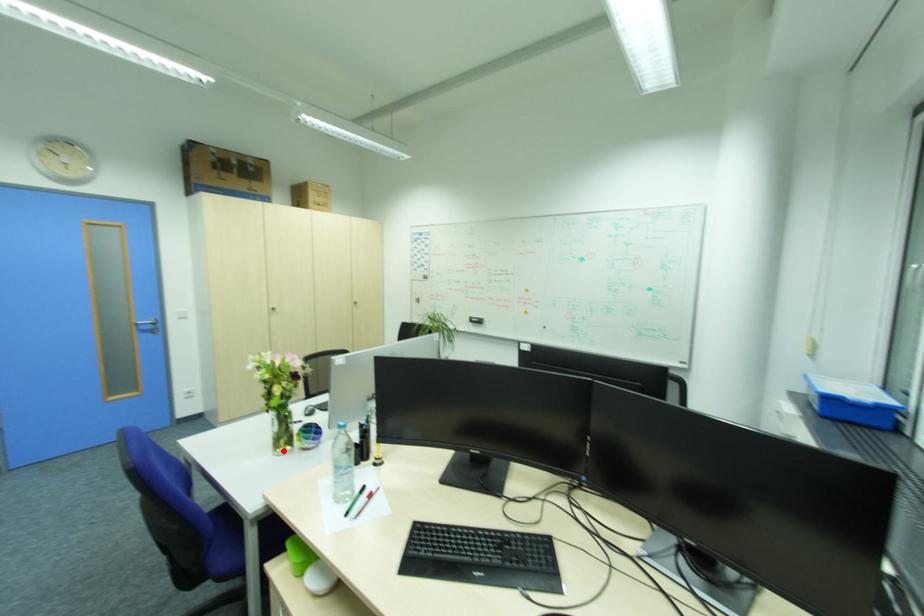
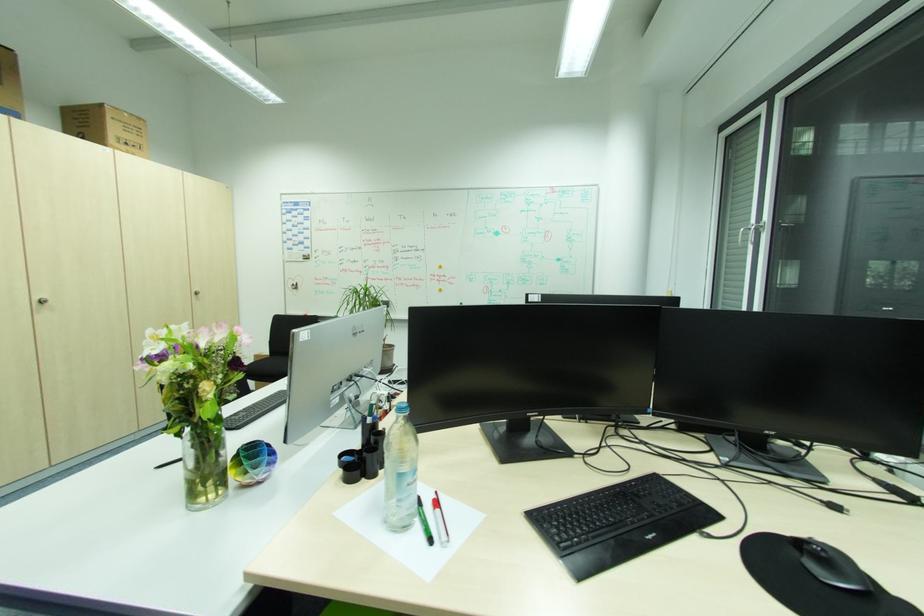
Where in the second image is the point corresponding to the highlighted location from the first image?

(208, 500)